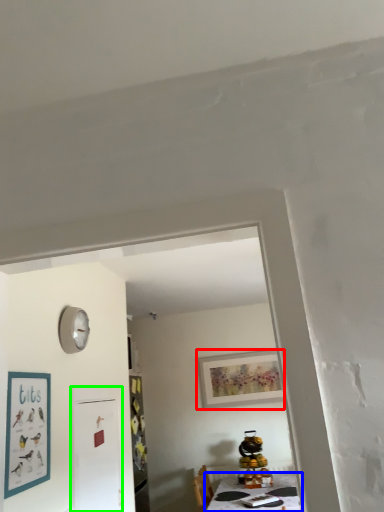
Question: Which is nearer to the picture frame (highlighted by a red box)? table (highlighted by a blue box) or fridge (highlighted by a green box).

Choices:
 (A) table
 (B) fridge

Answer: (A)